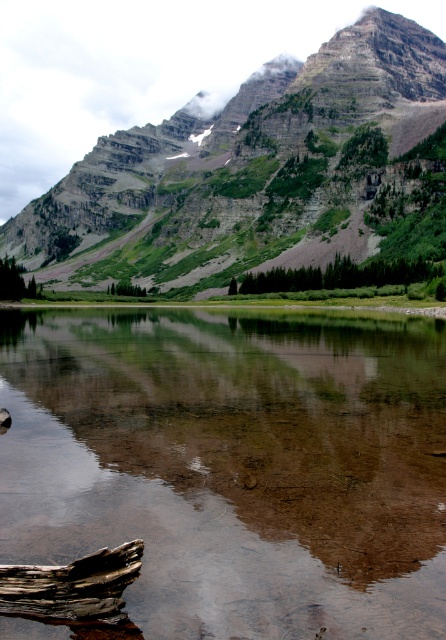
Question: Estimate the real-world distances between objects in this image. Which object is farther from the brown wood log at lower left?

Choices:
 (A) green matte tree at center
 (B) green leafy trees at center

Answer: (A)

Question: Can you confirm if clear water at center is bigger than brown wood log at lower left?

Choices:
 (A) no
 (B) yes

Answer: (B)

Question: Can you confirm if clear water at center is thinner than green leafy tree at lower left?

Choices:
 (A) yes
 (B) no

Answer: (B)

Question: Which point appears closest to the camera in this image?

Choices:
 (A) (304, 289)
 (B) (116, 355)
 (C) (12, 572)
 (D) (16, 300)

Answer: (C)

Question: Observing the image, what is the correct spatial positioning of green leafy trees at center in reference to green leafy tree at lower left?

Choices:
 (A) right
 (B) left

Answer: (A)

Question: Which is nearer to the clear water at center?

Choices:
 (A) green leafy tree at lower left
 (B) green leafy trees at center

Answer: (B)